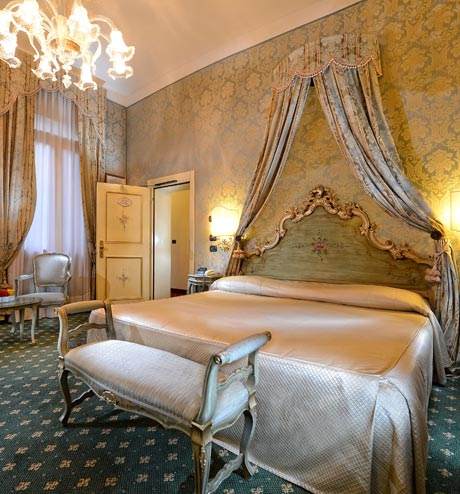
The width and height of the screenshot is (460, 494). Identify the location of 1 table. (12, 304).